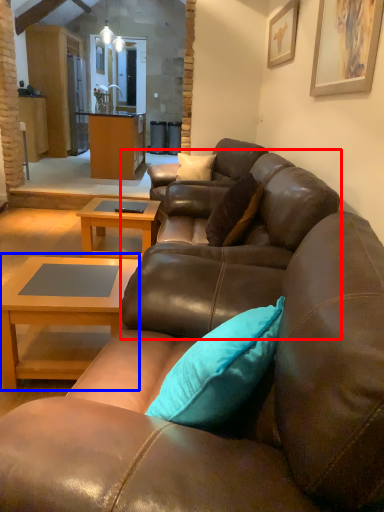
Question: Among these objects, which one is farthest to the camera, swivel chair (highlighted by a red box) or coffee table (highlighted by a blue box)?

Choices:
 (A) swivel chair
 (B) coffee table

Answer: (B)